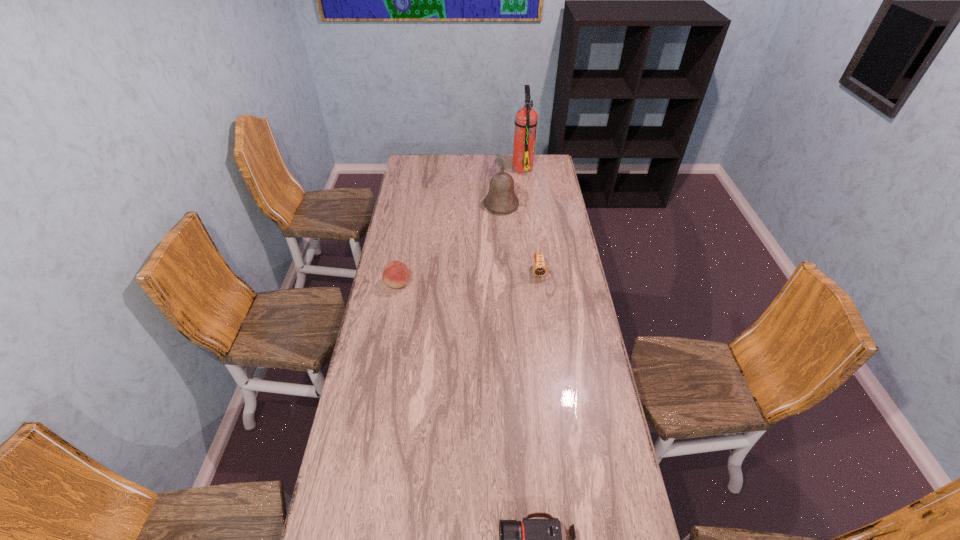
Locate an element on the screen. This screenshot has width=960, height=540. blank region between the fire extinguisher and the watch is located at coordinates (531, 220).

Identify the location of vacant space that is in between the bell and the watch. [x=519, y=239].

Where is `empty space between the watch and the leftmost object`? The image size is (960, 540). empty space between the watch and the leftmost object is located at coordinates (468, 278).

Find the location of a particular element. empty location between the watch and the leftmost object is located at coordinates (468, 278).

You are a GUI agent. You are given a task and a screenshot of the screen. Output one action in this format:
    pyautogui.click(x=<x>, y=<y>)
    Task: Click on the third closest object to the peach
    
    Given the screenshot: What is the action you would take?
    pyautogui.click(x=526, y=118)

At what (x,y) coordinates should I click in order to perform the action: click on the fourth closest object to the watch. Please return your answer as a coordinate pair (x, y). Looking at the image, I should click on (532, 539).

Locate an element on the screen. blank area in the image that satisfies the following two spatial constraints: 1. at the nozzle of the tallest object; 2. on the front side of the second tallest object is located at coordinates [527, 205].